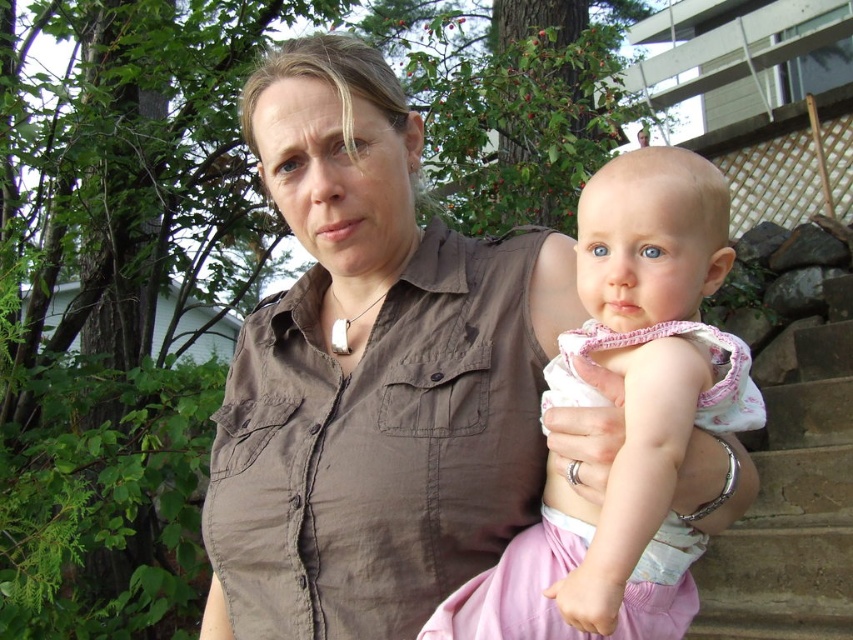
Question: Can you confirm if brown cotton shirt at center is positioned to the right of brown stone stairs at lower right?

Choices:
 (A) no
 (B) yes

Answer: (A)

Question: Is brown cotton shirt at center positioned in front of brown stone stairs at lower right?

Choices:
 (A) yes
 (B) no

Answer: (A)

Question: Which of the following is the closest to the observer?

Choices:
 (A) (584, 340)
 (B) (280, 308)
 (C) (595, 568)

Answer: (C)

Question: Among these points, which one is farthest from the camera?

Choices:
 (A) (485, 611)
 (B) (598, 442)
 (C) (814, 579)
 (D) (566, 620)

Answer: (C)

Question: Which of these objects is positioned closest to the brown cotton shirt at center?

Choices:
 (A) pink fabric at center
 (B) brown stone stairs at lower right
 (C) pink fabric baby at center

Answer: (C)

Question: Considering the relative positions of pink fabric at center and pink smooth skin at center in the image provided, where is pink fabric at center located with respect to pink smooth skin at center?

Choices:
 (A) left
 (B) right

Answer: (B)